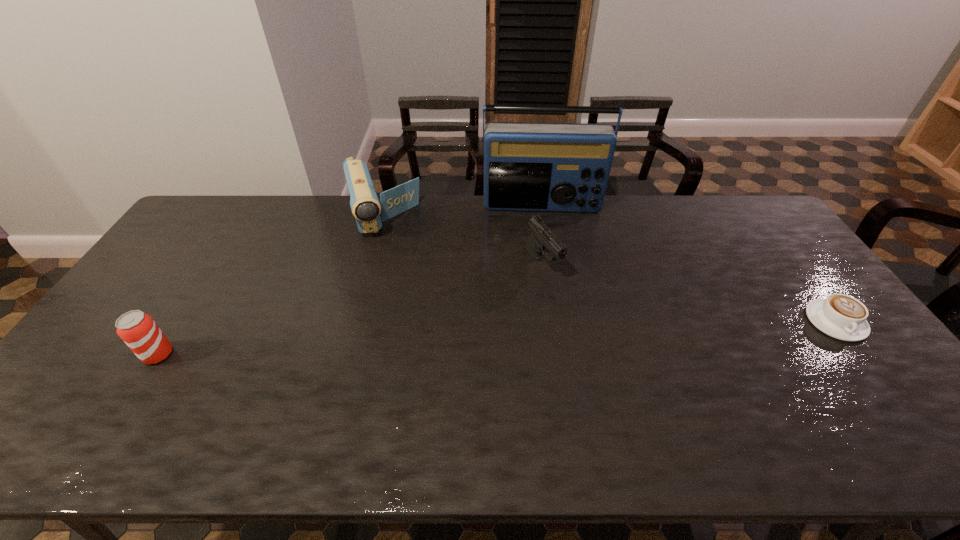
The image size is (960, 540). I want to click on beer can, so click(x=138, y=330).

Where is `the leftmost object`? The image size is (960, 540). the leftmost object is located at coordinates (138, 330).

Identify the location of cappuccino. (843, 317).

You are a GUI agent. You are given a task and a screenshot of the screen. Output one action in this format:
    pyautogui.click(x=<x>, y=<y>)
    Task: Click on the shortest object
    The image size is (960, 540).
    Given the screenshot: What is the action you would take?
    pyautogui.click(x=843, y=317)

Locate an element on the screen. The width and height of the screenshot is (960, 540). the tallest object is located at coordinates (554, 167).

Identify the location of the fourth shortest object. Image resolution: width=960 pixels, height=540 pixels. click(x=369, y=212).

Where is `camcorder`? The height and width of the screenshot is (540, 960). camcorder is located at coordinates (369, 212).

At what (x,y) coordinates should I click in order to perform the action: click on pistol. Please return your answer as a coordinate pair (x, y). This screenshot has width=960, height=540. Looking at the image, I should click on (542, 239).

I want to click on free location located 0.150m on the back of the leftmost object, so click(192, 302).

Locate an element on the screen. This screenshot has width=960, height=540. vacant space located 0.120m with the handle on the right side of the shortest object is located at coordinates (881, 382).